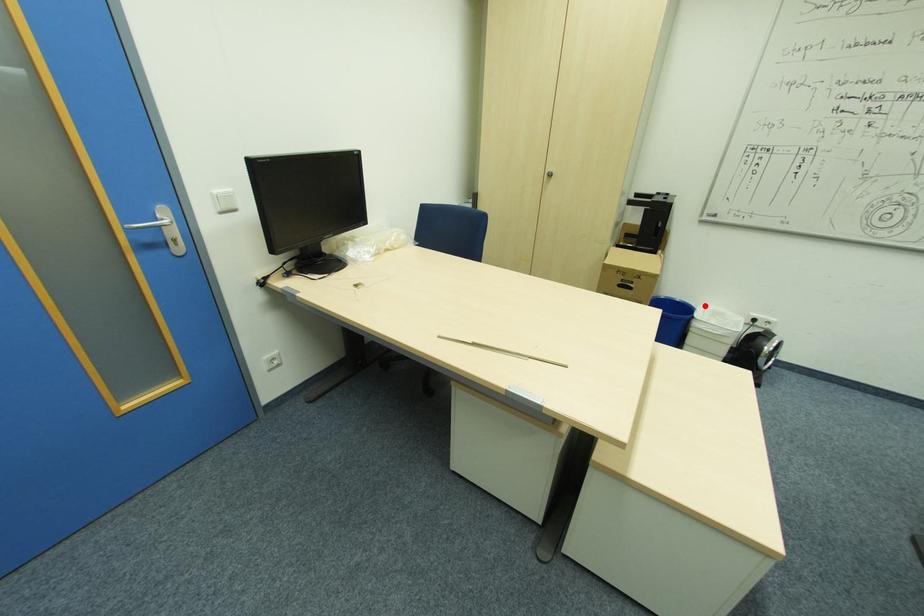
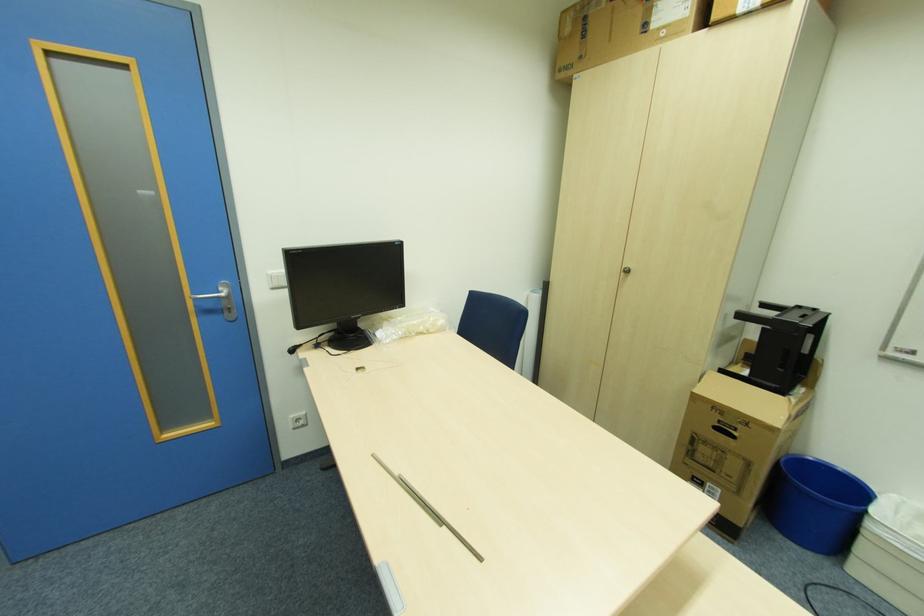
Locate, in the second image, the point that corresponds to the highlighted location in the first image.

(896, 496)